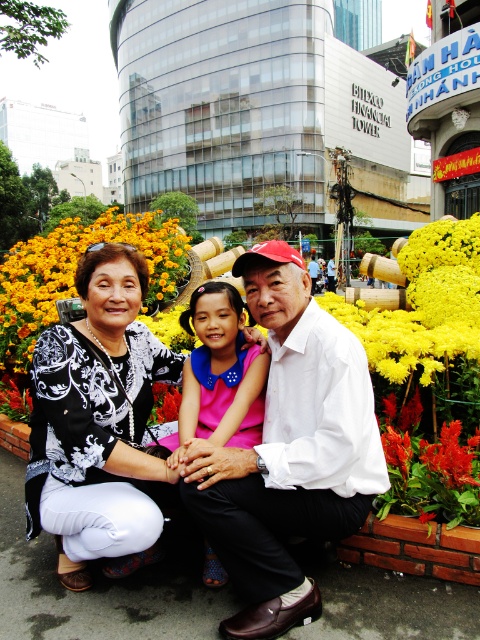
You are standing in the urban setting shown in the image. There is a point marked at coordinates (288, 451). What object is located at that point?

The point at coordinates (288, 451) corresponds to the white matte shirt at center.

You are standing at the point labeled point (311, 464) and want to move towards the point labeled point (43, 394). Given that you can only move in a straight line, will you be moving away from or towards the camera?

Since point (311, 464) is closer to the camera than point (43, 394), moving from point (311, 464) towards point (43, 394) would mean moving away from the camera.